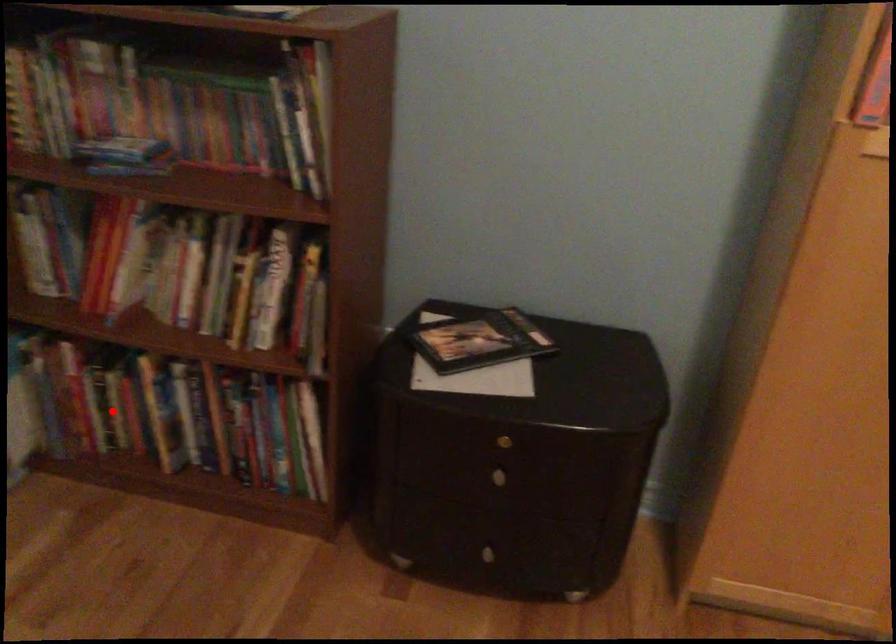
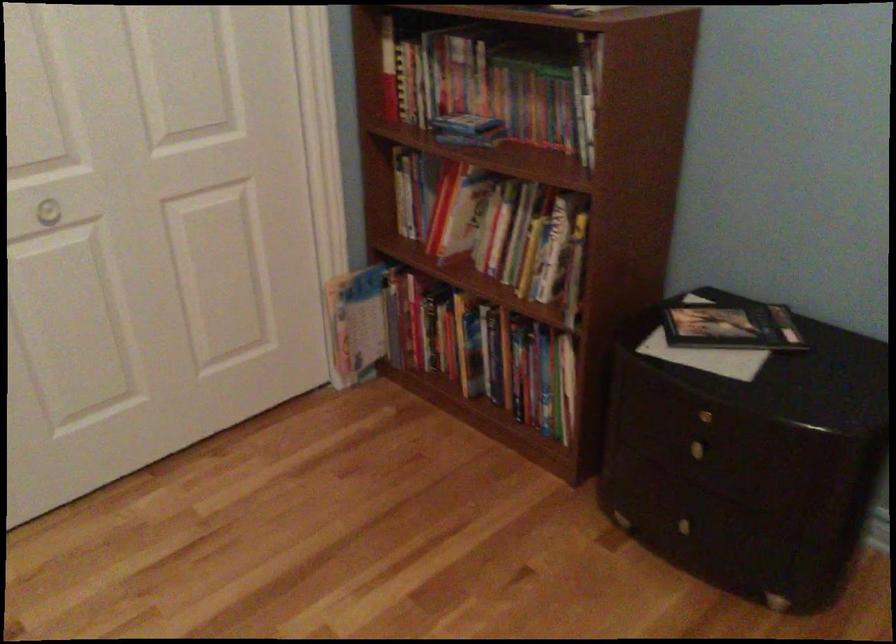
Find the pixel in the second image that matches the highlighted location in the first image.

(428, 335)